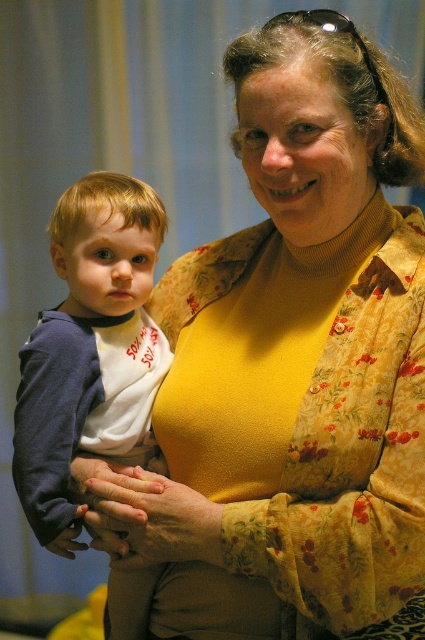
Between point (70, 372) and point (382, 92), which one is positioned in front?

Point (382, 92) is more forward.

Who is positioned more to the right, matte blue sweater at left or black plastic sunglasses at upper center?

black plastic sunglasses at upper center is more to the right.

At what (x,y) coordinates should I click in order to perform the action: click on matte blue sweater at left. Please return your answer as a coordinate pair (x, y). The height and width of the screenshot is (640, 425). Looking at the image, I should click on (87, 348).